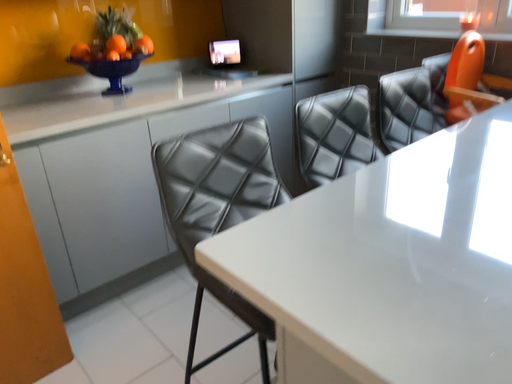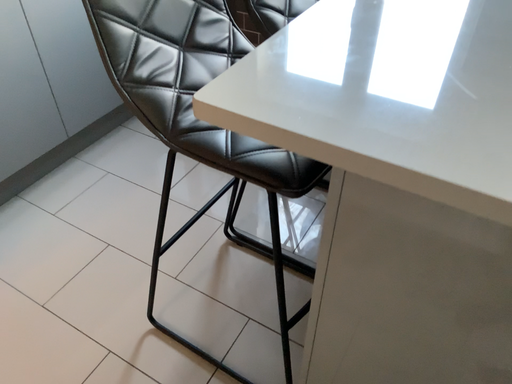
Question: How did the camera likely rotate when shooting the video?

Choices:
 (A) rotated upward
 (B) rotated downward

Answer: (B)